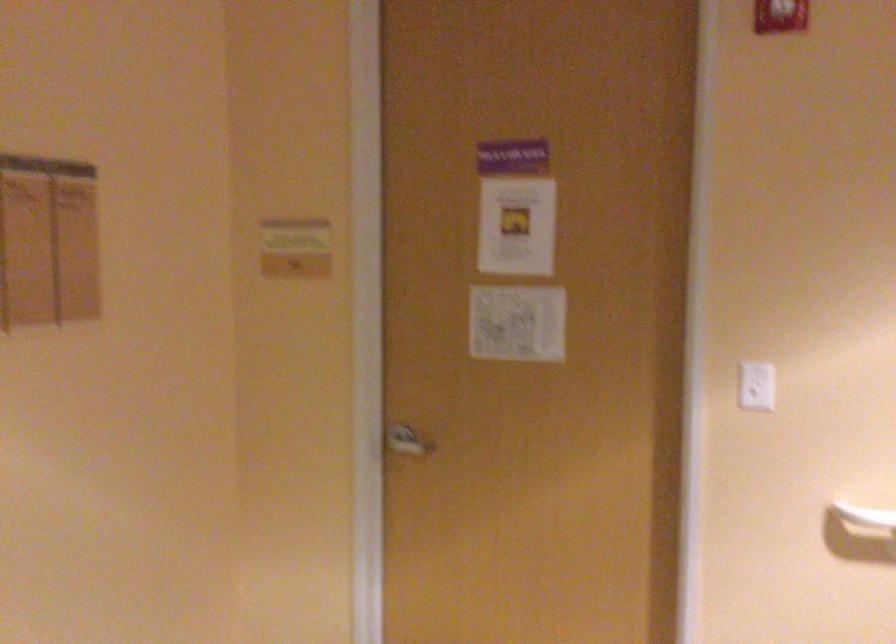
Identify the location of white light switch. The height and width of the screenshot is (644, 896). (755, 386).